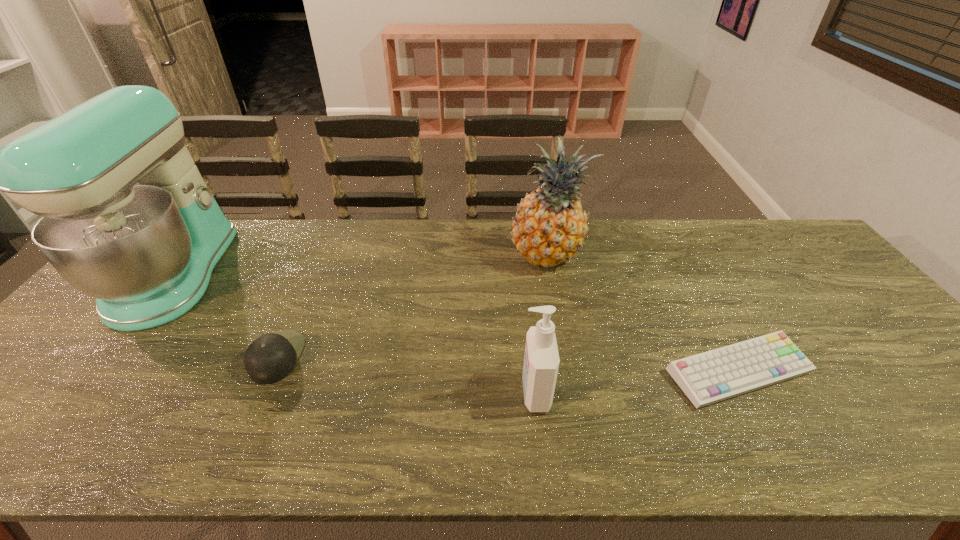
Locate an element on the screen. The image size is (960, 540). vacant region at the near edge is located at coordinates (504, 428).

The image size is (960, 540). I want to click on free space at the left edge of the desktop, so click(16, 423).

At what (x,y) coordinates should I click in order to perform the action: click on free location at the right edge. Please return your answer as a coordinate pair (x, y). The height and width of the screenshot is (540, 960). Looking at the image, I should click on (898, 415).

The image size is (960, 540). I want to click on vacant area between the computer keyboard and the fourth tallest object, so click(508, 364).

The width and height of the screenshot is (960, 540). I want to click on free space that is in between the fourth tallest object and the third tallest object, so click(x=406, y=375).

Find the location of a particular element. free space that is in between the leftmost object and the fourth shortest object is located at coordinates (362, 265).

This screenshot has width=960, height=540. In order to click on vacant area that lies between the pineapple and the shortest object in this screenshot , I will do `click(643, 314)`.

The width and height of the screenshot is (960, 540). Find the location of `vacant space that's between the fourth tallest object and the shortest object`. vacant space that's between the fourth tallest object and the shortest object is located at coordinates (508, 364).

This screenshot has width=960, height=540. In order to click on unoccupied position between the third tallest object and the leftmost object in this screenshot , I will do `click(355, 333)`.

Find the location of a particular element. This screenshot has height=540, width=960. vacant area that lies between the rightmost object and the pineapple is located at coordinates (643, 314).